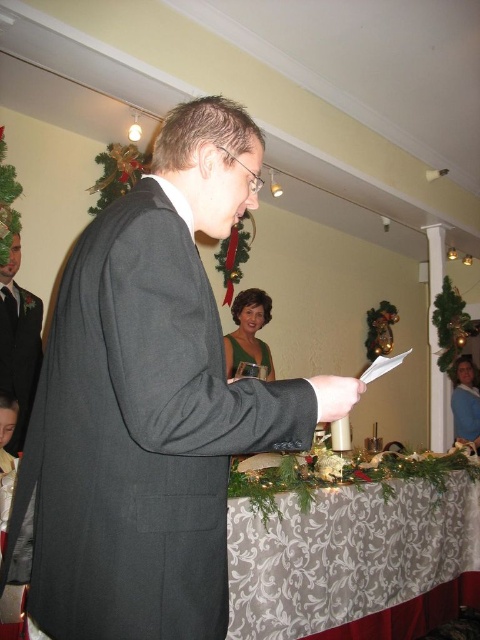
You are a photographer at a holiday event and need to decide which dress to feature in your photo. Both the green satin dress at center and the green velvet dress at center are in the frame. Which dress is narrower in width?

The green satin dress at center is narrower in width than the green velvet dress at center.

You are standing in the festive room and want to place a small decoration between the two points, point (149, 195) and point (24, 358). Which point should you start from to ensure the decoration is closer to the viewer?

You should start from point (149, 195) because it is closer to the viewer than point (24, 358).

You are a photographer trying to capture a closeup shot of the dark gray suit at center. The camera you are using has a minimum focusing distance of 24 inches. Can you get the closeup without moving either the camera or the subject?

The dark gray suit at center and camera are 26.32 inches apart from each other. Since the minimum focusing distance is 24 inches, the camera can focus on the dark gray suit at center as the distance is within the required range.